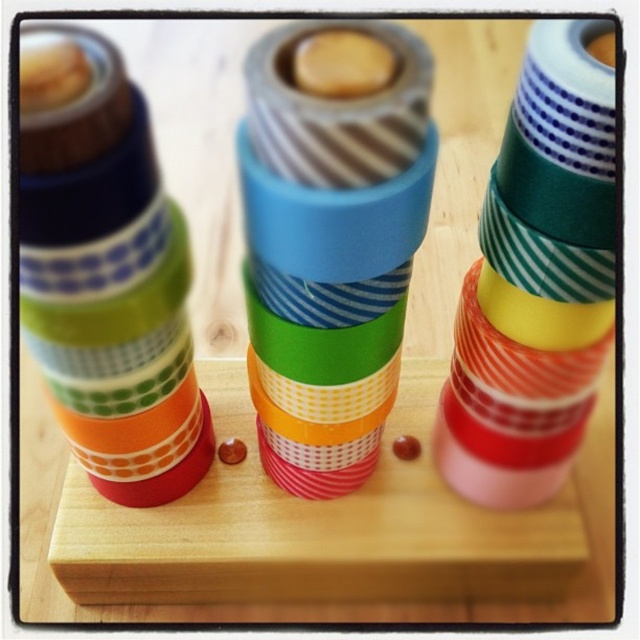
Question: Which point is farther from the camera taking this photo?

Choices:
 (A) (284, 362)
 (B) (35, 230)

Answer: (A)

Question: Can you confirm if matte plastic tape at center is wider than matte plastic cups at left?

Choices:
 (A) yes
 (B) no

Answer: (B)

Question: From the image, what is the correct spatial relationship of matte plastic tape at center in relation to matte plastic cups at left?

Choices:
 (A) below
 (B) above

Answer: (A)

Question: In this image, where is matte plastic tape at center located relative to matte plastic cups at left?

Choices:
 (A) above
 (B) below

Answer: (B)